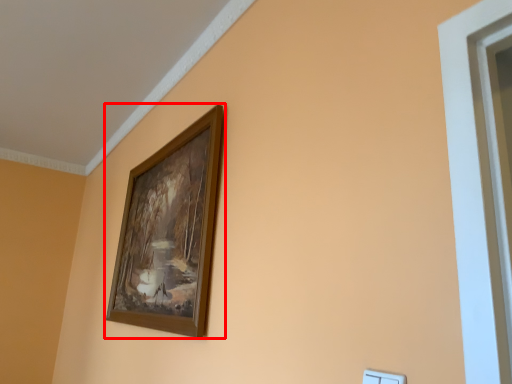
Question: Considering the relative positions of picture frame (annotated by the red box) and light switch in the image provided, where is picture frame (annotated by the red box) located with respect to the staircase?

Choices:
 (A) right
 (B) left

Answer: (B)